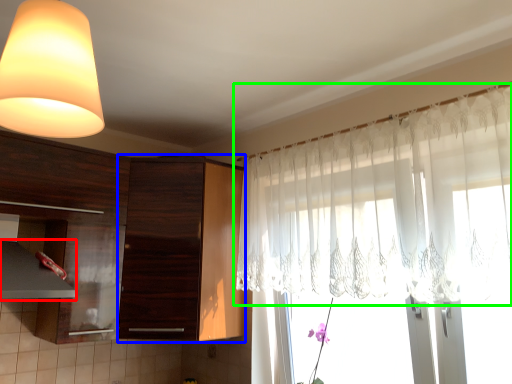
Question: Which is nearer to the exhaust hood (highlighted by a red box)? cabinetry (highlighted by a blue box) or curtain (highlighted by a green box).

Choices:
 (A) cabinetry
 (B) curtain

Answer: (A)